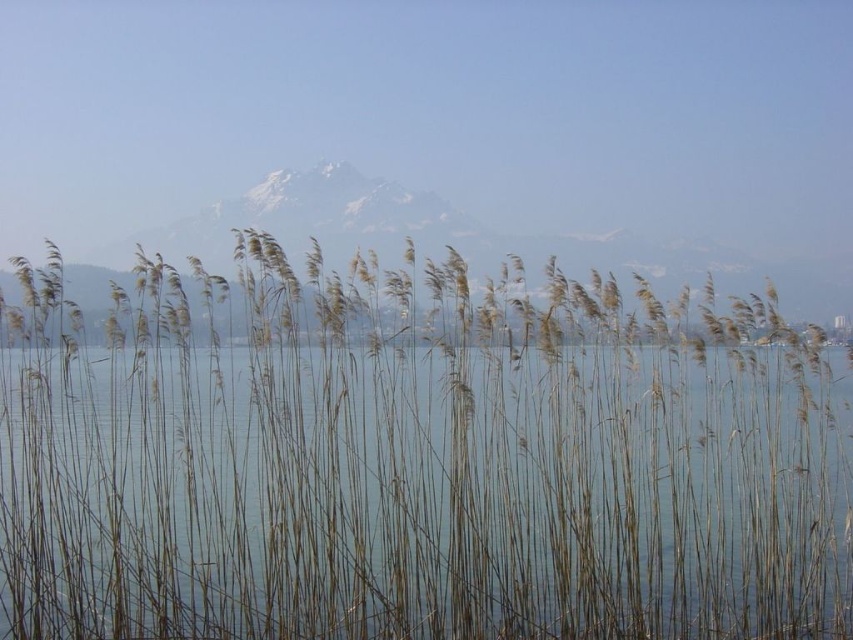
Is point (817, 582) behind point (729, 248)?

No, (817, 582) is closer to viewer.

From the picture: Between dry reeds at center and snowy rock mountain at center, which one appears on the right side from the viewer's perspective?

Positioned to the right is snowy rock mountain at center.

Find the location of a particular element. This screenshot has height=640, width=853. dry reeds at center is located at coordinates (416, 472).